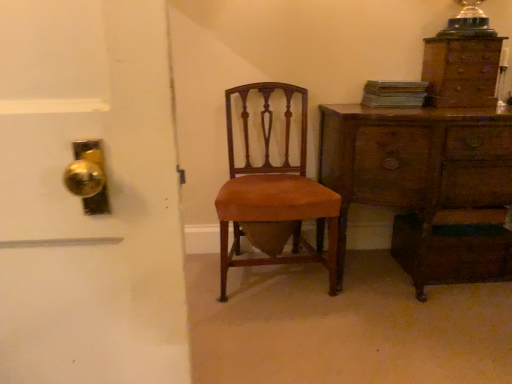
Question: In terms of width, does translucent glass lampshade at upper right look wider or thinner when compared to brown wood chair at center?

Choices:
 (A) wide
 (B) thin

Answer: (B)

Question: Looking at the image, does translucent glass lampshade at upper right seem bigger or smaller compared to brown wood chair at center?

Choices:
 (A) small
 (B) big

Answer: (A)

Question: Which of these objects is positioned closest to the wooden chest of drawers at right, placed as the second chest of drawers when sorted from top to bottom?

Choices:
 (A) wooden chest of drawers at upper right, which appears as the first chest of drawers when viewed from the top
 (B) brown wood chair at center
 (C) translucent glass lampshade at upper right

Answer: (B)

Question: Estimate the real-world distances between objects in this image. Which object is farther from the wooden chest of drawers at right, the first chest of drawers positioned from the bottom?

Choices:
 (A) brown wood chair at center
 (B) wooden chest of drawers at upper right, which appears as the first chest of drawers when viewed from the top
 (C) translucent glass lampshade at upper right

Answer: (C)